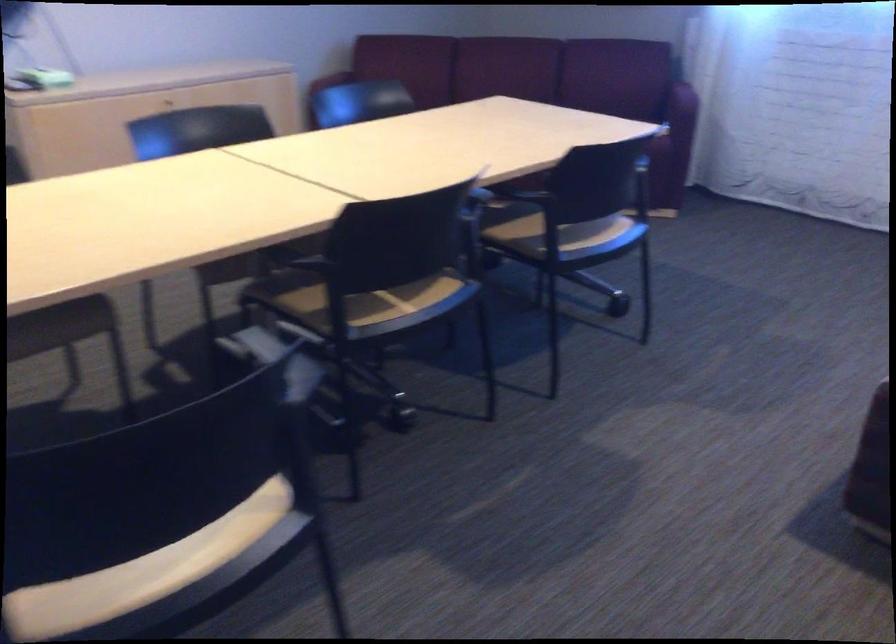
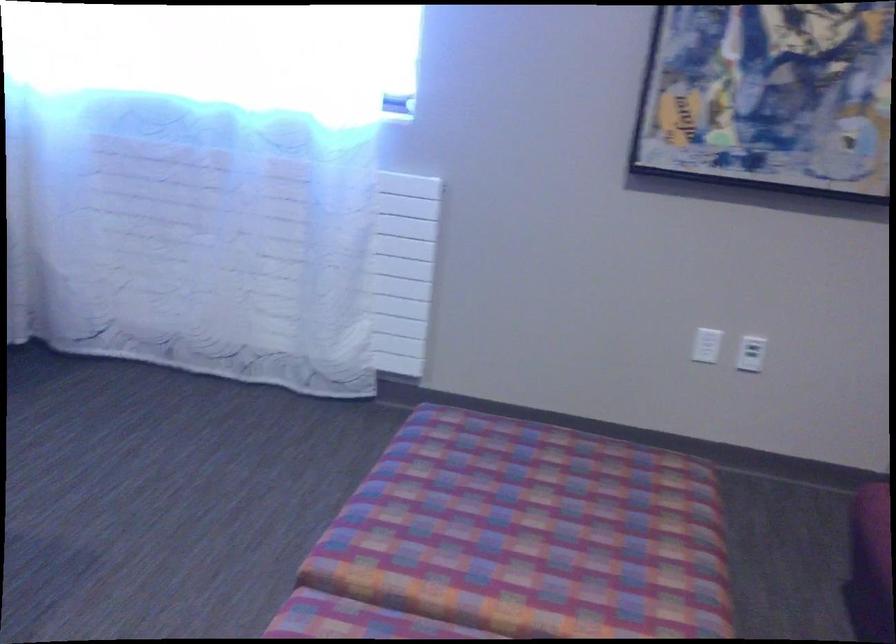
Which direction would the cameraman need to move to produce the second image?

The cameraman walked toward right, forward.